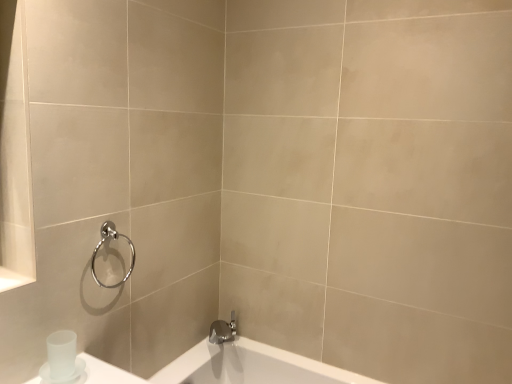
Question: From the image's perspective, is polished chrome towel ring at upper left beneath satin nickel faucet at lower center?

Choices:
 (A) no
 (B) yes

Answer: (A)

Question: Is polished chrome towel ring at upper left smaller than satin nickel faucet at lower center?

Choices:
 (A) yes
 (B) no

Answer: (B)

Question: From a real-world perspective, is polished chrome towel ring at upper left under satin nickel faucet at lower center?

Choices:
 (A) no
 (B) yes

Answer: (A)

Question: Considering the relative positions of polished chrome towel ring at upper left and satin nickel faucet at lower center in the image provided, is polished chrome towel ring at upper left to the right of satin nickel faucet at lower center from the viewer's perspective?

Choices:
 (A) yes
 (B) no

Answer: (B)

Question: Is polished chrome towel ring at upper left positioned far away from satin nickel faucet at lower center?

Choices:
 (A) no
 (B) yes

Answer: (A)

Question: Is point (86, 364) positioned closer to the camera than point (109, 223)?

Choices:
 (A) closer
 (B) farther

Answer: (A)

Question: From the image's perspective, is satin white cup at lower left located above or below polished chrome towel ring at upper left?

Choices:
 (A) below
 (B) above

Answer: (A)

Question: Is satin white cup at lower left situated inside polished chrome towel ring at upper left or outside?

Choices:
 (A) outside
 (B) inside

Answer: (A)

Question: Is satin white cup at lower left to the left or to the right of polished chrome towel ring at upper left in the image?

Choices:
 (A) left
 (B) right

Answer: (A)

Question: From the image's perspective, is satin nickel faucet at lower center positioned above or below polished chrome towel ring at upper left?

Choices:
 (A) below
 (B) above

Answer: (A)

Question: Is satin nickel faucet at lower center bigger or smaller than polished chrome towel ring at upper left?

Choices:
 (A) small
 (B) big

Answer: (A)

Question: Choose the correct answer: Is satin nickel faucet at lower center inside polished chrome towel ring at upper left or outside it?

Choices:
 (A) inside
 (B) outside

Answer: (B)

Question: Is satin nickel faucet at lower center wider or thinner than polished chrome towel ring at upper left?

Choices:
 (A) thin
 (B) wide

Answer: (B)

Question: Is point (221, 326) positioned closer to the camera than point (47, 377)?

Choices:
 (A) farther
 (B) closer

Answer: (A)

Question: From the image's perspective, is satin nickel faucet at lower center positioned above or below satin white cup at lower left?

Choices:
 (A) above
 (B) below

Answer: (B)